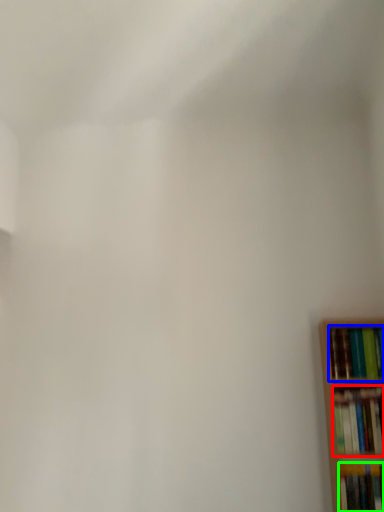
Question: Based on their relative distances, which object is farther from book (highlighted by a red box)? Choose from book (highlighted by a blue box) and book (highlighted by a green box).

Choices:
 (A) book
 (B) book

Answer: (A)